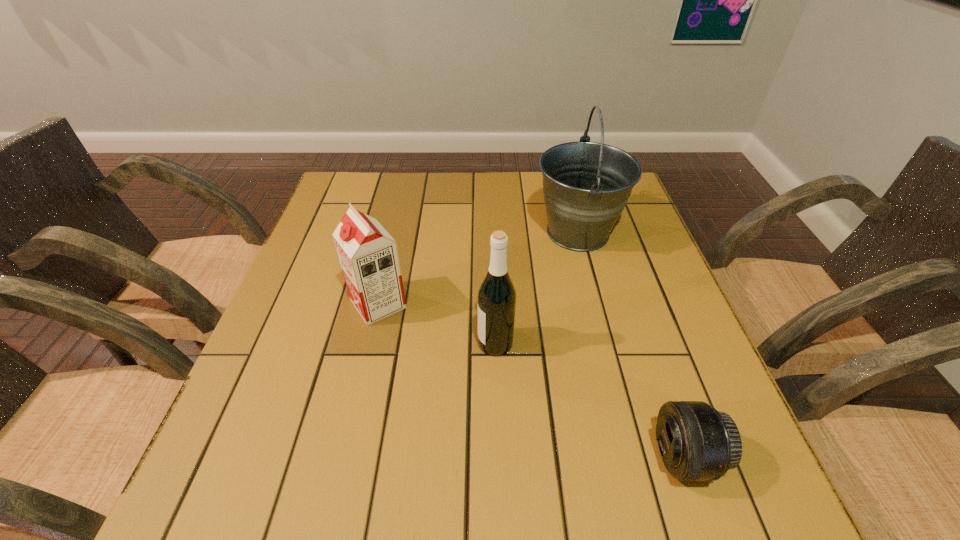
Find the location of a particular element. This screenshot has width=960, height=540. free spot between the wine bottle and the shortest object is located at coordinates (590, 400).

In order to click on free space that is in between the nearest object and the third object from right to left in this screenshot , I will do `click(590, 400)`.

Find the location of a particular element. This screenshot has height=540, width=960. free space between the farthest object and the shortest object is located at coordinates (631, 345).

What are the coordinates of `unoccupied position between the tallest object and the wine bottle` in the screenshot? It's located at (537, 288).

In order to click on blank region between the wine bottle and the tallest object in this screenshot , I will do coord(537,288).

Find the location of a particular element. The image size is (960, 540). free space between the leftmost object and the farthest object is located at coordinates (478, 268).

The image size is (960, 540). What are the coordinates of `free spot between the second object from left to right and the tallest object` in the screenshot? It's located at (537, 288).

I want to click on vacant space in between the soya milk and the shortest object, so click(x=532, y=381).

Find the location of `free space that is in between the wine bottle and the nearest object`. free space that is in between the wine bottle and the nearest object is located at coordinates (590, 400).

The width and height of the screenshot is (960, 540). Identify the location of the second closest object relative to the farthest object. (368, 255).